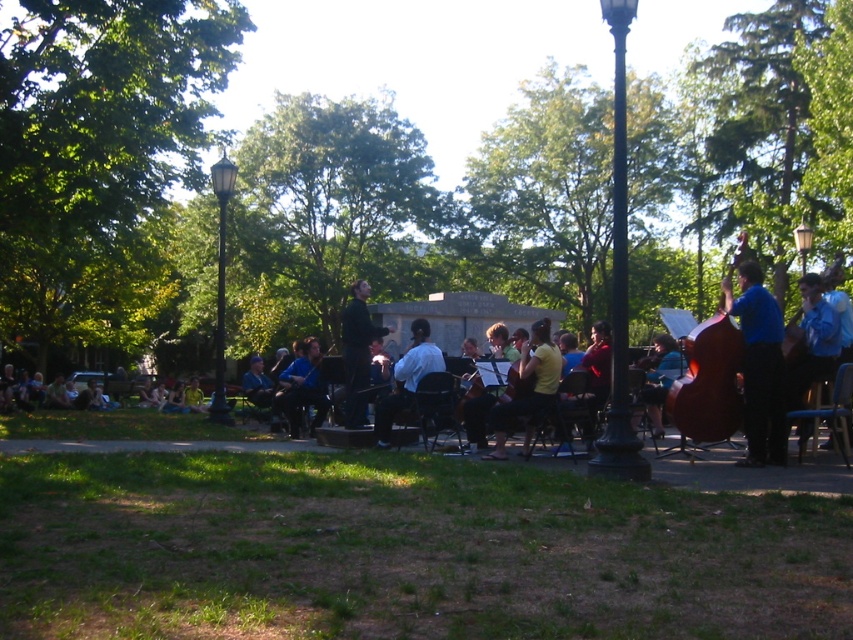
Who is lower down, blue fabric bass at right or blue fabric cello at center?

blue fabric cello at center

Does blue fabric bass at right have a lesser height compared to blue fabric cello at center?

Incorrect, blue fabric bass at right's height does not fall short of blue fabric cello at center's.

Is point (753, 273) behind point (670, 380)?

No, (753, 273) is closer to viewer.

Where is `blue fabric bass at right`? The width and height of the screenshot is (853, 640). blue fabric bass at right is located at coordinates (759, 365).

Can you confirm if blue fabric bass at right is thinner than blue fabric shirt at right?

Yes.

Between point (728, 276) and point (804, 371), which one is positioned behind?

The point (728, 276) is more distant.

Describe the element at coordinates (759, 365) in the screenshot. This screenshot has width=853, height=640. I see `blue fabric bass at right` at that location.

You are a GUI agent. You are given a task and a screenshot of the screen. Output one action in this format:
    pyautogui.click(x=<x>, y=<y>)
    Task: Click on the blue fabric bass at right
    The image size is (853, 640).
    Given the screenshot: What is the action you would take?
    pyautogui.click(x=759, y=365)

Which is behind, point (498, 422) or point (657, 352)?

The point (657, 352) is more distant.

In the scene shown: Can you confirm if yellow matte shirt at center is smaller than blue fabric cello at center?

Yes.

Measure the distance between yellow matte shirt at center and camera.

They are 10.73 meters apart.

Identify the location of yellow matte shirt at center. The height and width of the screenshot is (640, 853). (527, 387).